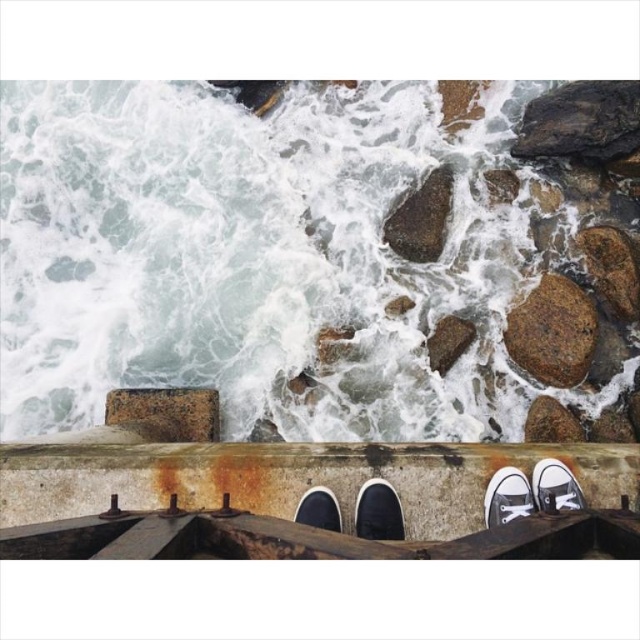
Question: Observing the image, what is the correct spatial positioning of rusty concrete ledge at lower center in reference to white canvas shoe at lower right?

Choices:
 (A) right
 (B) left

Answer: (B)

Question: Estimate the real-world distances between objects in this image. Which object is closer to the rusty stone at upper right?

Choices:
 (A) white canvas shoe at center
 (B) white canvas shoe at lower center
 (C) black canvas shoe at center

Answer: (B)

Question: Which object is closer to the camera taking this photo?

Choices:
 (A) rusty concrete ledge at lower center
 (B) white frothy water at upper left

Answer: (A)

Question: Is rusty concrete ledge at lower center thinner than rusty stone at upper right?

Choices:
 (A) yes
 (B) no

Answer: (B)

Question: Which point is closer to the camera?

Choices:
 (A) white canvas shoe at lower center
 (B) rusty concrete ledge at lower center
 (C) white canvas shoe at center
 (D) white canvas shoe at lower right

Answer: (A)

Question: Is white frothy water at upper left further to the viewer compared to rusty metal stone at lower center?

Choices:
 (A) yes
 (B) no

Answer: (A)